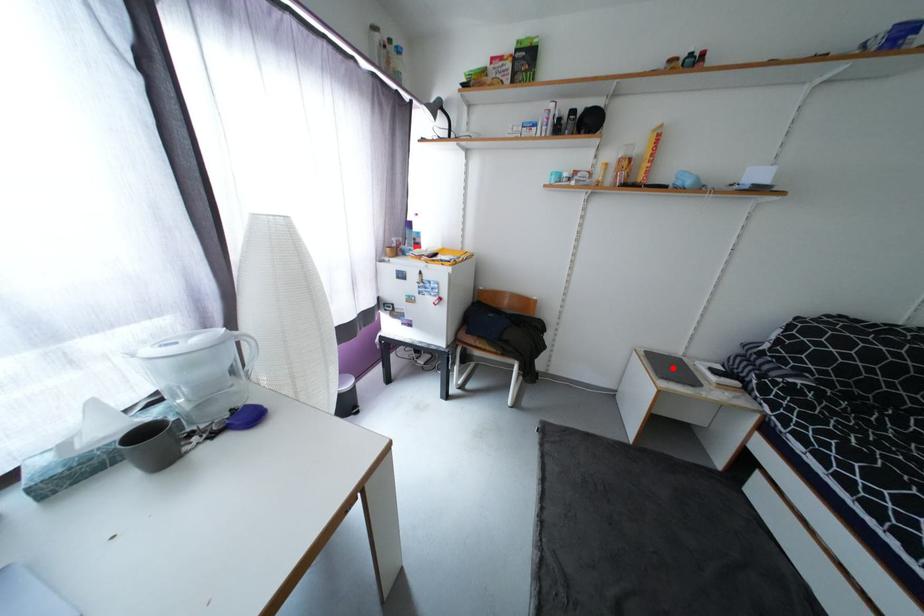
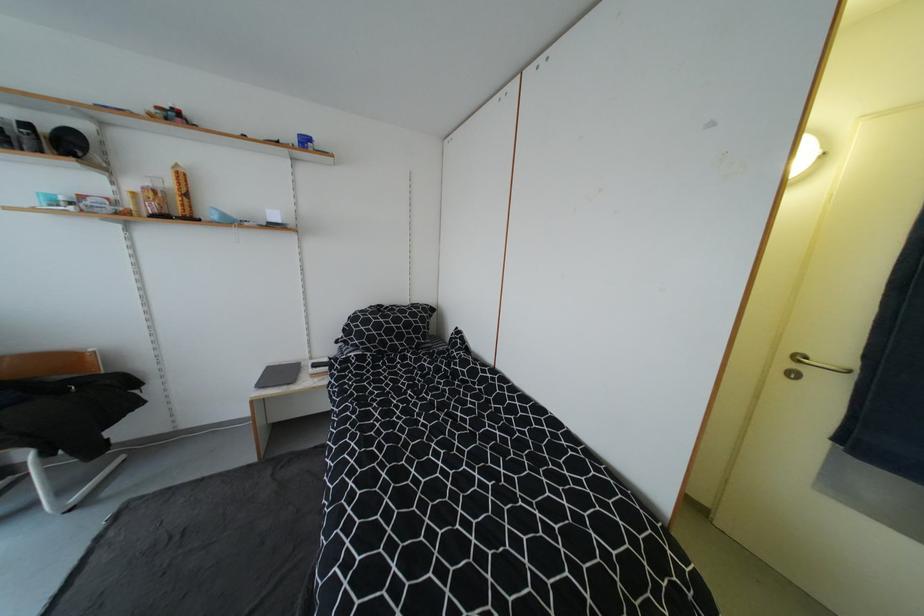
Find the pixel in the second image that matches the highlighted location in the first image.

(286, 376)